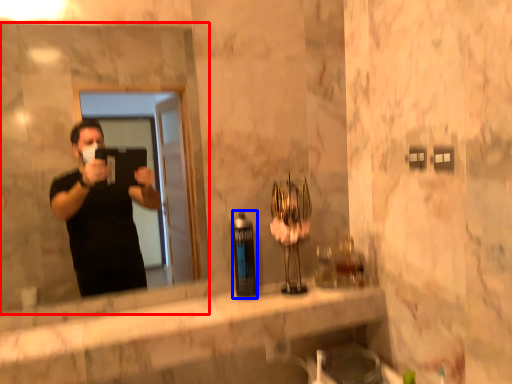
Question: Which object is closer to the camera taking this photo, mirror (highlighted by a red box) or bottle (highlighted by a blue box)?

Choices:
 (A) mirror
 (B) bottle

Answer: (A)